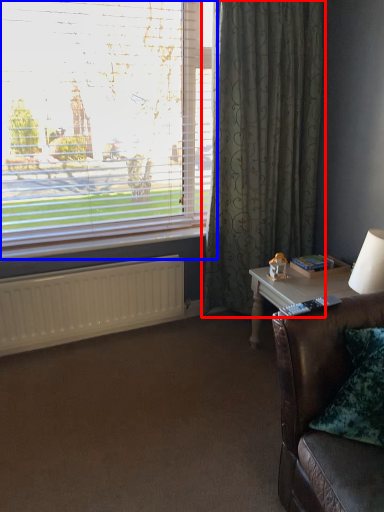
Question: Which of the following is the farthest to the observer, curtain (highlighted by a red box) or window (highlighted by a blue box)?

Choices:
 (A) curtain
 (B) window

Answer: (A)